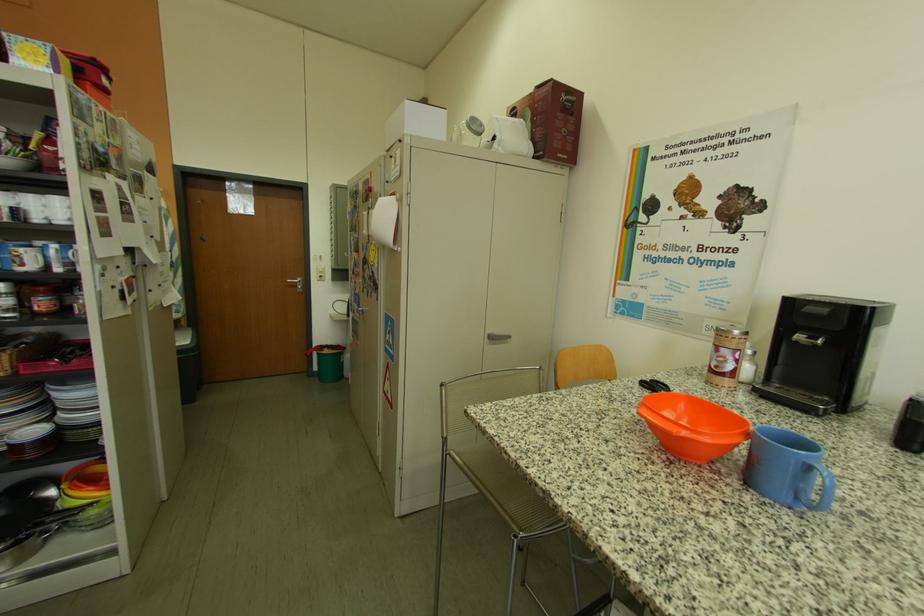
The location [748,367] corresponds to which object?

This point indicates the white salt shaker.